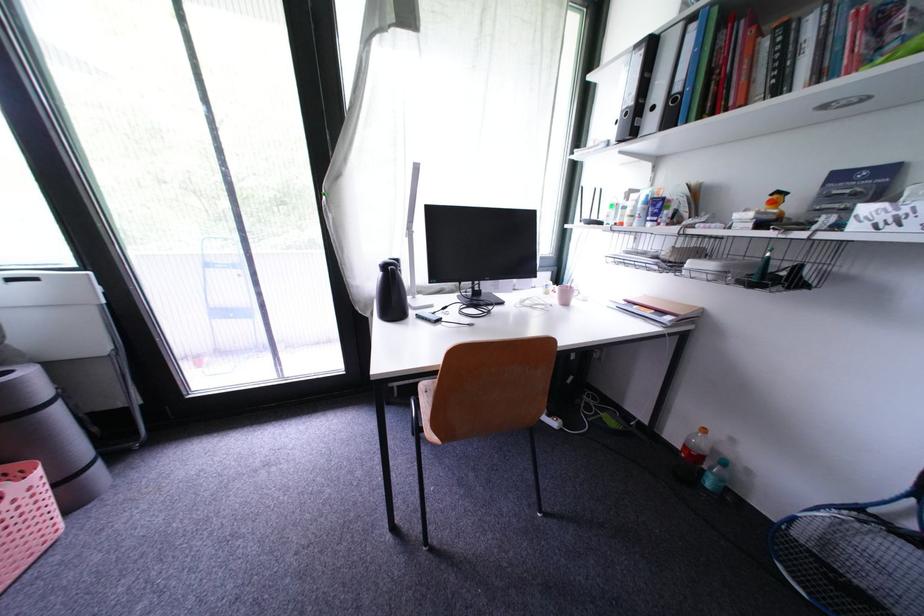
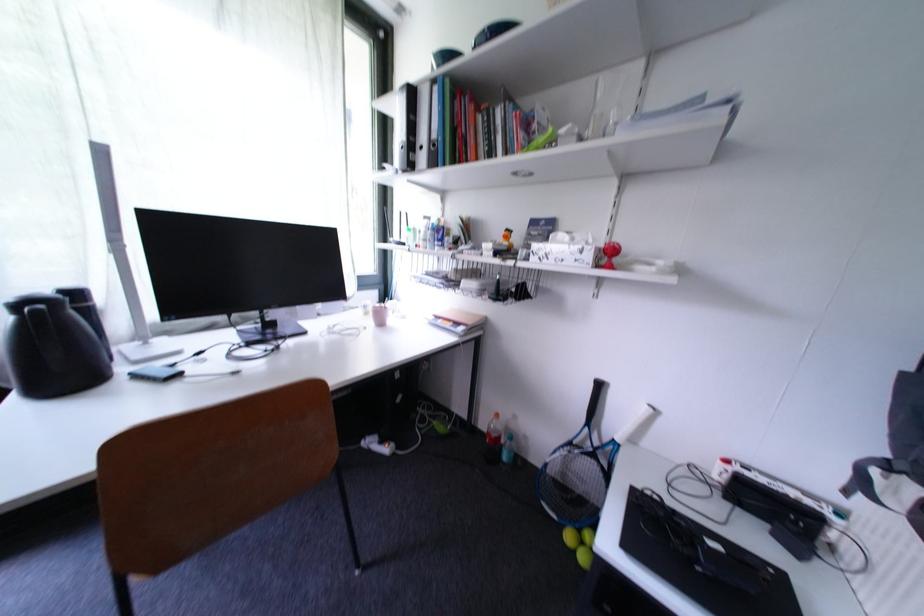
Locate, in the second image, the point that corresponds to [398,272] in the first image.

(43, 313)